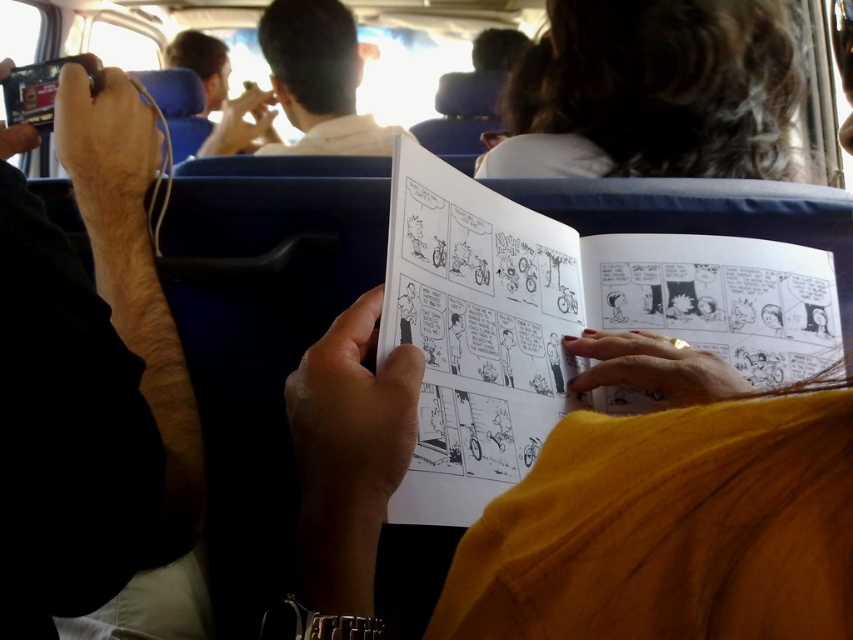
Question: Estimate the real-world distances between objects in this image. Which object is farther from the black plastic phone at left?

Choices:
 (A) dark curly hair at upper center
 (B) light brown hair at upper center

Answer: (B)

Question: Is black paper comic book at center thinner than dark curly hair at upper center?

Choices:
 (A) no
 (B) yes

Answer: (A)

Question: Does dark curly hair at upper center have a larger size compared to light brown hair at upper center?

Choices:
 (A) yes
 (B) no

Answer: (B)

Question: Which point is closer to the camera taking this photo?

Choices:
 (A) (695, 140)
 (B) (717, 236)

Answer: (B)

Question: Is dark curly hair at upper center bigger than light brown hair at upper center?

Choices:
 (A) yes
 (B) no

Answer: (B)

Question: Among these objects, which one is nearest to the camera?

Choices:
 (A) black paper comic book at center
 (B) dark curly hair at upper center
 (C) black plastic phone at left
 (D) light brown hair at upper center

Answer: (C)